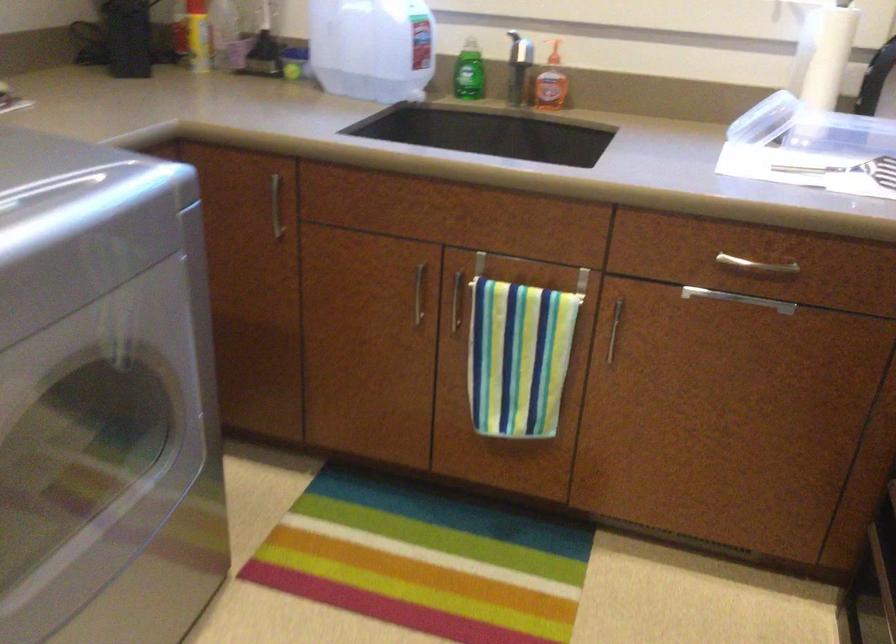
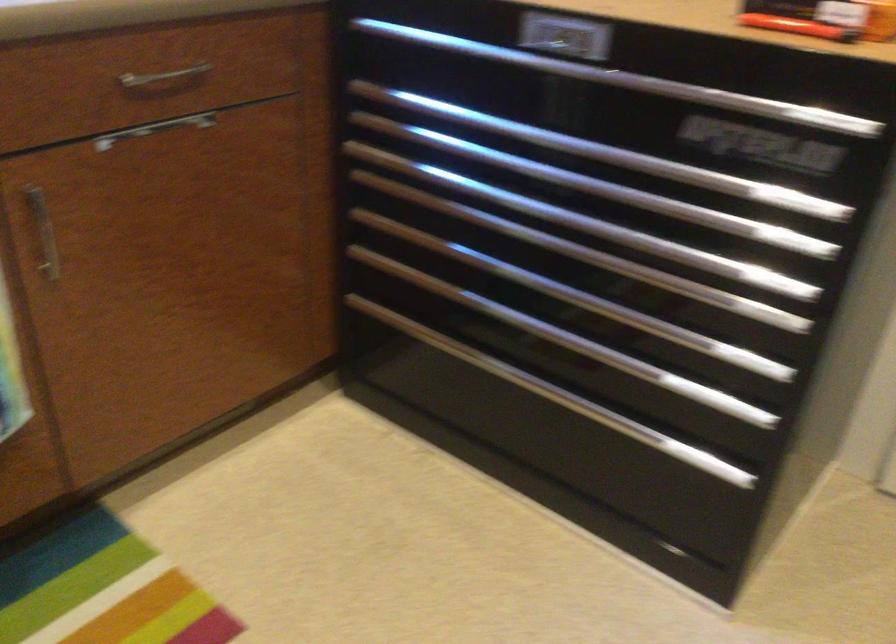
In the second image, find the point that corresponds to (621,328) in the first image.

(42, 232)